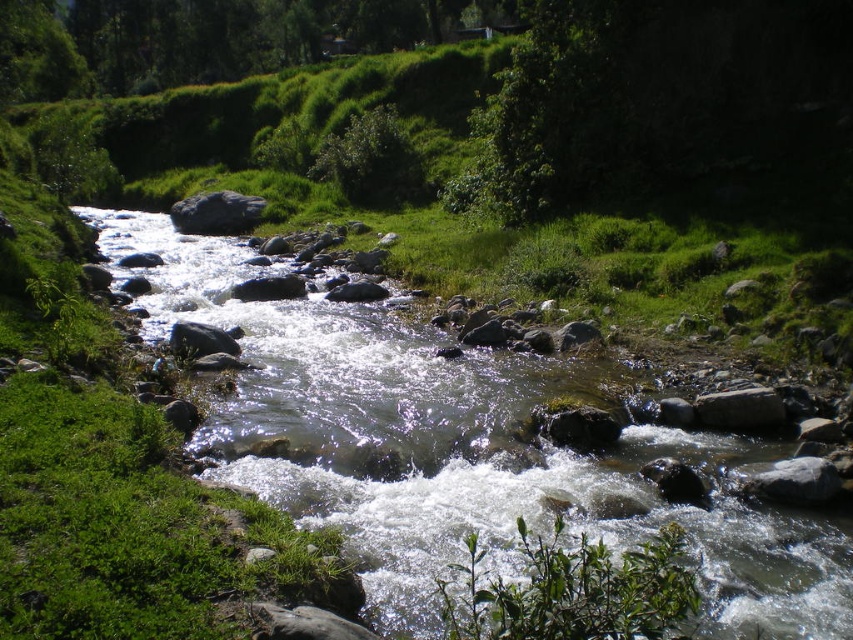
You are a hiker standing at the edge of the stream and see the green leafy tree at upper center and the gray smooth rock at center. Which object is located to the left of the other?

The green leafy tree at upper center is positioned on the left side of gray smooth rock at center.

You are a hiker trying to cross the stream. You notice the clear water at center and the green leafy tree at upper center. Which object is narrower in width?

The clear water at center is thinner than the green leafy tree at upper center, so the clear water at center is narrower in width.

You are a hiker trying to cross the stream. You see the clear water at center and the gray smooth rock at center. Which one is taller? Please choose between the two.

Answer: The clear water at center has a greater height compared to the gray smooth rock at center, so the clear water at center is taller.